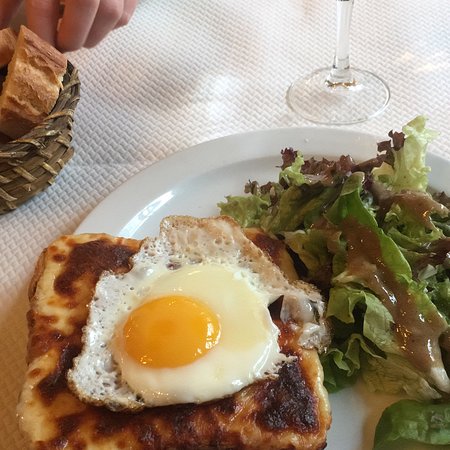
Identify the location of tablecloth. (238, 101).